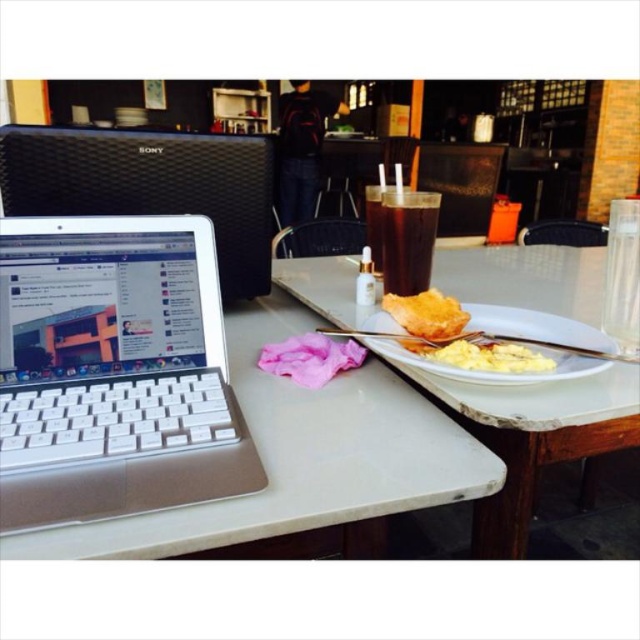
Based on the photo, does white plastic table at lower left come behind dark brown glass at center?

No, it is not.

How far apart are white plastic table at lower left and dark brown glass at center?

The distance of white plastic table at lower left from dark brown glass at center is 13.05 inches.

The image size is (640, 640). In order to click on white plastic table at lower left in this screenshot , I will do `click(300, 458)`.

Identify the location of white plastic table at lower left. (300, 458).

Is white marble plate at center shorter than dark brown glass at center?

No.

Is white marble plate at center smaller than dark brown glass at center?

No, white marble plate at center is not smaller than dark brown glass at center.

Between point (602, 266) and point (376, 204), which one is positioned behind?

Point (602, 266)

You are a GUI agent. You are given a task and a screenshot of the screen. Output one action in this format:
    pyautogui.click(x=<x>, y=<y>)
    Task: Click on the white marble plate at center
    The height and width of the screenshot is (640, 640).
    Given the screenshot: What is the action you would take?
    pyautogui.click(x=532, y=436)

Who is lower down, white fluffy scrambled eggs at right or golden crispy bread at center?

Positioned lower is white fluffy scrambled eggs at right.

Image resolution: width=640 pixels, height=640 pixels. What do you see at coordinates (490, 356) in the screenshot?
I see `white fluffy scrambled eggs at right` at bounding box center [490, 356].

Which is behind, point (547, 364) or point (465, 310)?

The point (465, 310) is behind.

Identify the location of white fluffy scrambled eggs at right. (490, 356).